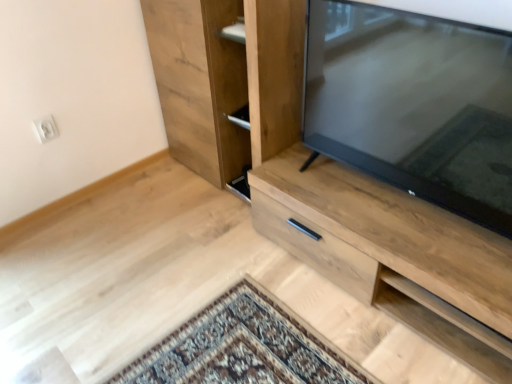
The image size is (512, 384). What are the coordinates of `free space above light wood cabinet at center (from a real-world perspective)` in the screenshot? It's located at (383, 209).